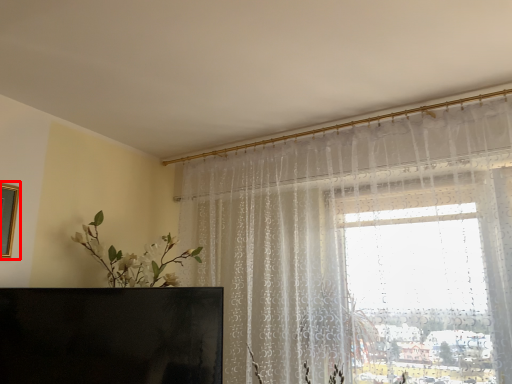
Question: Observing the image, what is the correct spatial positioning of picture frame (annotated by the red box) in reference to furniture?

Choices:
 (A) right
 (B) left

Answer: (B)